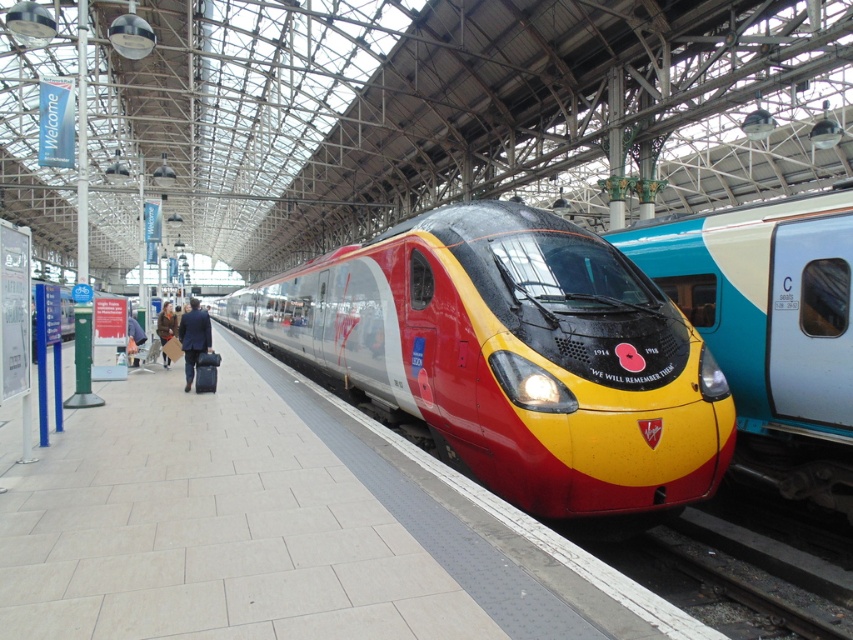
You are standing on the platform at the train station and see two points marked on the platform. The first point is at coordinate point (x=49, y=493) and the second point is at coordinate point (x=701, y=291). Which point is closer to you?

Point (x=49, y=493) is closer to you than point (x=701, y=291).

You are standing at the point marked as point (281, 529) on the platform. What material is the surface you are standing on made of?

The surface at point (281, 529) is smooth concrete platform at center.

You are standing at the point labeled as point (511, 356) on the platform. What is the closest object to you?

The closest object to you at point (511, 356) is the metallic silver train at center.